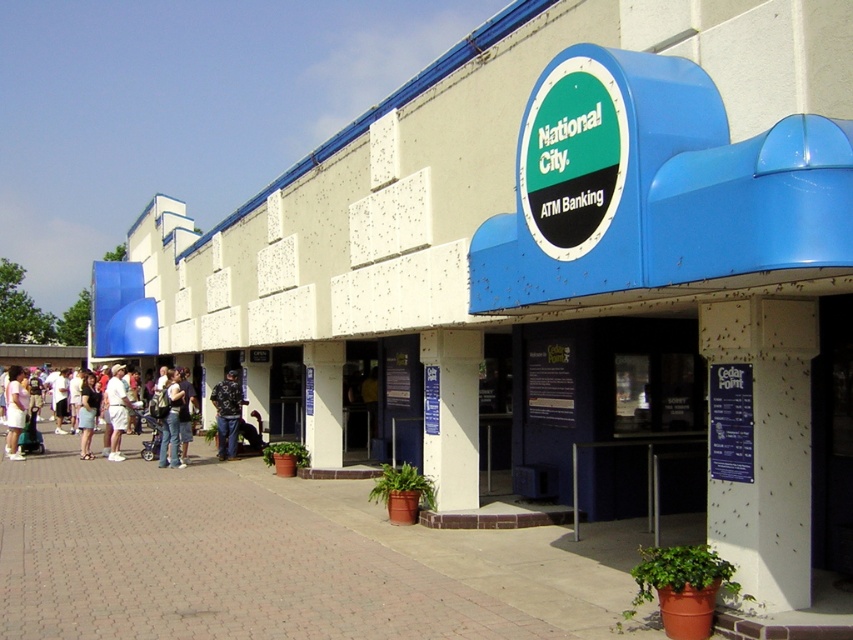
You are a customer entering the National City ATM Banking branch and see a camouflage jacket at center and jeans at center. Which item is positioned to the right side from your perspective?

The camouflage jacket at center is to the right of jeans at center, so the camouflage jacket at center is positioned to the right side.

You are a customer standing at the entrance of the National City ATM Banking branch. You notice a person wearing jeans at center and a matte white shirt at lower left in the scene. Which piece of clothing is positioned higher relative to the other?

The jeans at center is above the matte white shirt at lower left, so the jeans at center is positioned higher.

You are a customer entering the National City ATM Banking branch and see a camouflage jacket at center and jeans at center. Which item is closer to the entrance?

The camouflage jacket at center is closer to the entrance because the jeans at center are behind it.